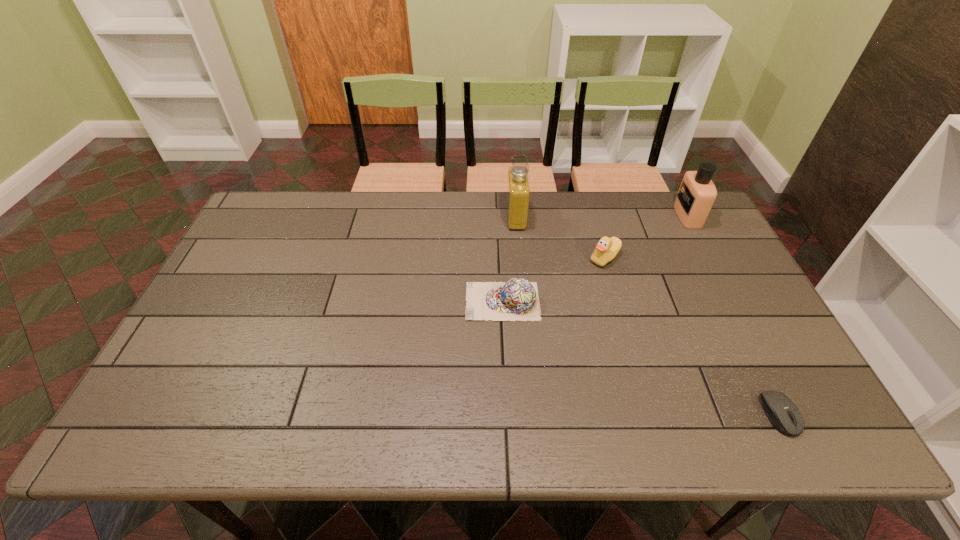
I want to click on the left perfume, so click(x=518, y=188).

You are a GUI agent. You are given a task and a screenshot of the screen. Output one action in this format:
    pyautogui.click(x=<x>, y=<y>)
    Task: Click on the right perfume
    
    Given the screenshot: What is the action you would take?
    pyautogui.click(x=697, y=193)

This screenshot has width=960, height=540. In order to click on duck in this screenshot , I will do `click(607, 248)`.

Where is `the third tallest object`? The image size is (960, 540). the third tallest object is located at coordinates (607, 248).

At what (x,y) coordinates should I click in order to perform the action: click on cap. Please return your answer as a coordinate pair (x, y). The image size is (960, 540). Looking at the image, I should click on (518, 299).

You are a GUI agent. You are given a task and a screenshot of the screen. Output one action in this format:
    pyautogui.click(x=<x>, y=<y>)
    Task: Click on the fourth tallest object
    The width and height of the screenshot is (960, 540).
    Given the screenshot: What is the action you would take?
    click(518, 299)

Identify the location of computer equipment. click(x=781, y=411).

Locate an element on the screen. The image size is (960, 540). the shortest object is located at coordinates pos(781,411).

Locate an element on the screen. vacant space located 0.120m on the front-facing side of the left perfume is located at coordinates (471, 218).

Where is `free spot located 0.320m on the front-facing side of the left perfume`? The image size is (960, 540). free spot located 0.320m on the front-facing side of the left perfume is located at coordinates (411, 218).